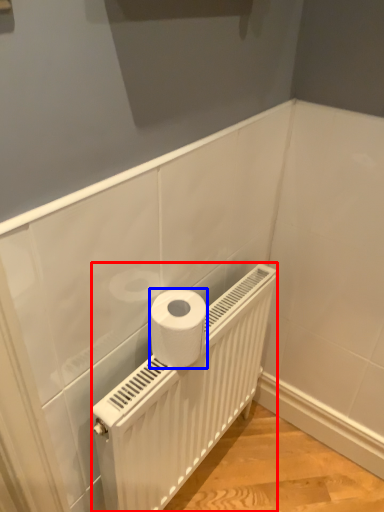
Question: Which object appears closest to the camera in this image, radiator (highlighted by a red box) or toilet paper (highlighted by a blue box)?

Choices:
 (A) radiator
 (B) toilet paper

Answer: (A)